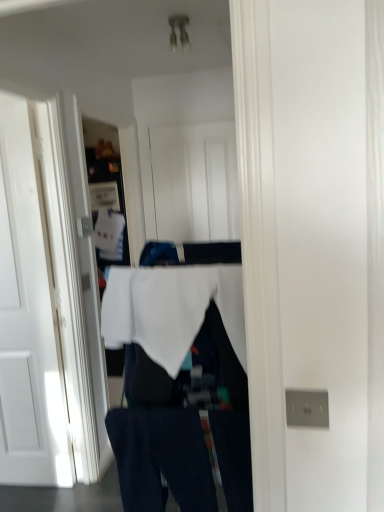
Find the location of a particular element. The height and width of the screenshot is (512, 384). empty space that is ontop of white wood door at center, positioned as the 2th door in left-to-right order (from a real-world perspective) is located at coordinates (180, 118).